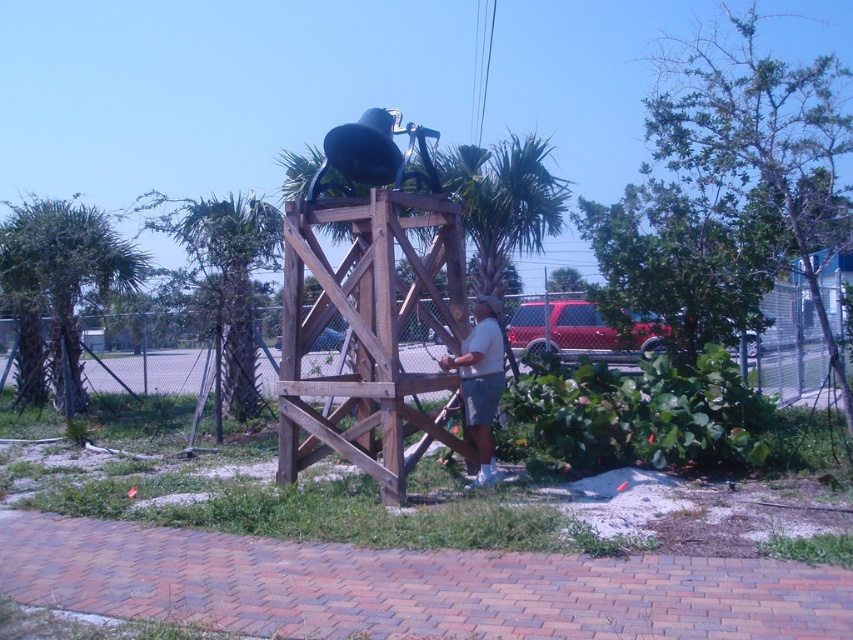
You are standing at the base of the wooden bell tower and want to water the green leafy palm tree at left. Your watering can holds enough water to reach 10 meters. Do you think you can water it without moving closer?

The green leafy palm tree at left is 12.10 meters from viewer, so no, you cannot water it without moving closer because the watering can only reaches 10 meters.

You are standing in the outdoor area and want to take a photo of the green leafy palm tree at center and the white cotton shirt at center. Which one is positioned higher in the frame?

The green leafy palm tree at center is above the white cotton shirt at center, so it is positioned higher in the frame.